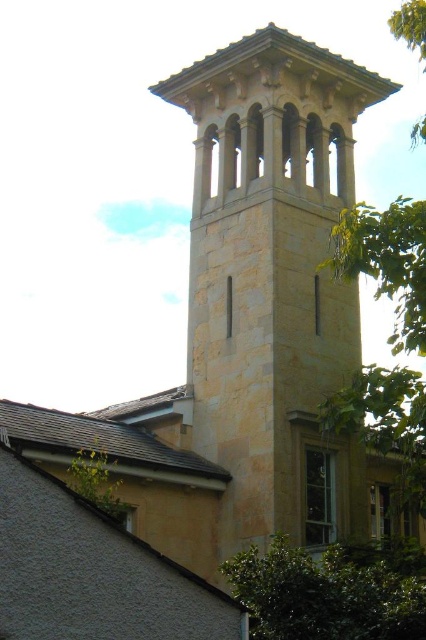
You are standing at the center of the image and want to locate the green leafy tree at lower right. In which direction should you look to find it?

The green leafy tree at lower right is located at point (331, 589), so you should look to the lower right direction from the center to find it.

You are standing at the base of the tower and want to take a photo of the point at coordinates point (324, 349). If your camera has a maximum zoom range of 50 meters, will you be able to capture the point clearly in your photo?

The point at coordinates point (324, 349) is 58.13 meters away from the camera. Since the camera can only zoom up to 50 meters, it will not be able to capture the point clearly at this distance.

You are standing at the base of the beige stone church tower at upper center. You want to place a 10 meter ladder against it to reach the top. Is the ladder long enough?

The beige stone church tower at upper center and viewer are 51.52 meters apart. The ladder is only 10 meters long, so it is not long enough to reach the top of the beige stone church tower at upper center.